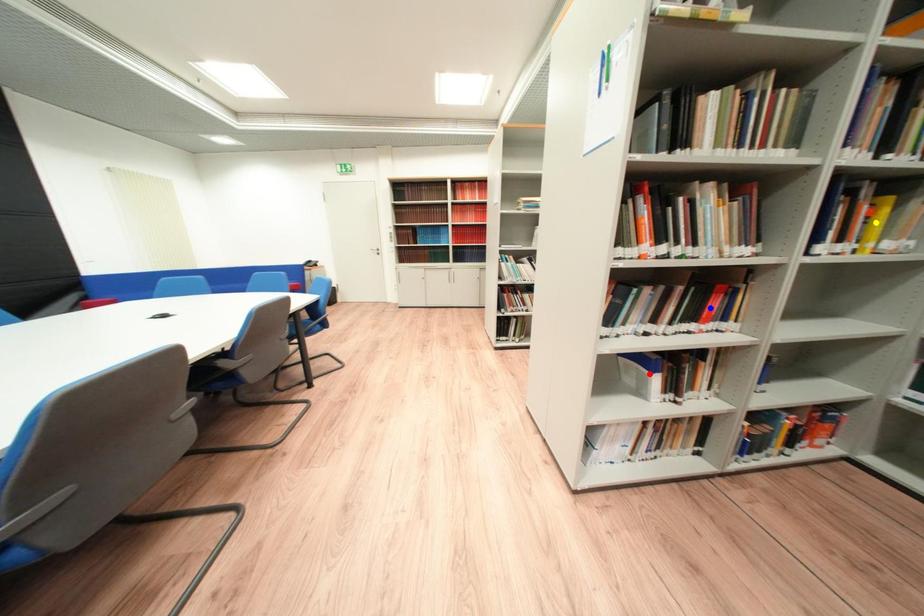
Order these from nearest to farthest:
A) blue point
B) yellow point
C) red point

yellow point < blue point < red point